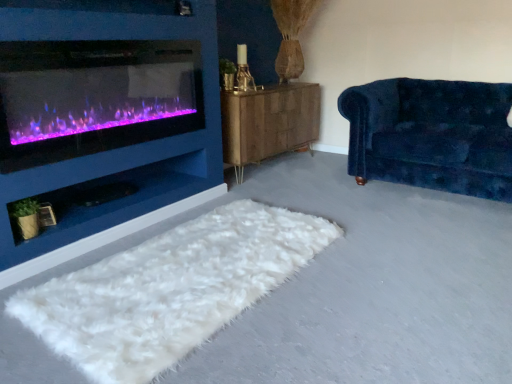
Question: Is the depth of purple glass wood burning stove at left greater than that of velvet blue couch at right?

Choices:
 (A) yes
 (B) no

Answer: (B)

Question: From a real-world perspective, is purple glass wood burning stove at left over velvet blue couch at right?

Choices:
 (A) yes
 (B) no

Answer: (A)

Question: Is purple glass wood burning stove at left thinner than velvet blue couch at right?

Choices:
 (A) no
 (B) yes

Answer: (B)

Question: Is purple glass wood burning stove at left at the right side of velvet blue couch at right?

Choices:
 (A) no
 (B) yes

Answer: (A)

Question: Considering the relative sizes of purple glass wood burning stove at left and velvet blue couch at right in the image provided, is purple glass wood burning stove at left taller than velvet blue couch at right?

Choices:
 (A) no
 (B) yes

Answer: (A)

Question: Can we say purple glass wood burning stove at left lies outside velvet blue couch at right?

Choices:
 (A) yes
 (B) no

Answer: (A)

Question: Is the depth of velvet blue couch at right greater than that of purple glass wood burning stove at left?

Choices:
 (A) no
 (B) yes

Answer: (B)

Question: Does velvet blue couch at right contain purple glass wood burning stove at left?

Choices:
 (A) yes
 (B) no

Answer: (B)

Question: Can you confirm if velvet blue couch at right is smaller than purple glass wood burning stove at left?

Choices:
 (A) yes
 (B) no

Answer: (B)

Question: Is velvet blue couch at right shorter than purple glass wood burning stove at left?

Choices:
 (A) yes
 (B) no

Answer: (B)

Question: Is velvet blue couch at right oriented away from purple glass wood burning stove at left?

Choices:
 (A) no
 (B) yes

Answer: (A)

Question: Is there a large distance between velvet blue couch at right and purple glass wood burning stove at left?

Choices:
 (A) yes
 (B) no

Answer: (A)

Question: Is white fluffy rug at lower center located within velvet blue couch at right?

Choices:
 (A) no
 (B) yes

Answer: (A)